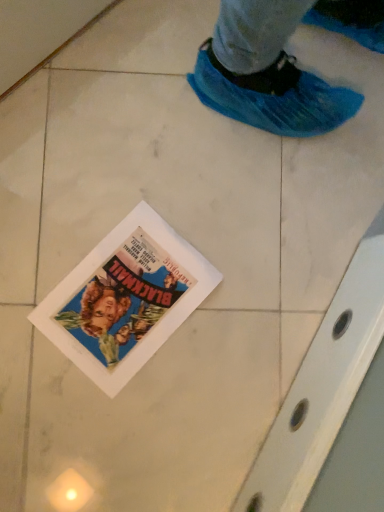
Locate an element on the screen. The width and height of the screenshot is (384, 512). vacant space underneath white paper at center (from a real-world perspective) is located at coordinates (126, 295).